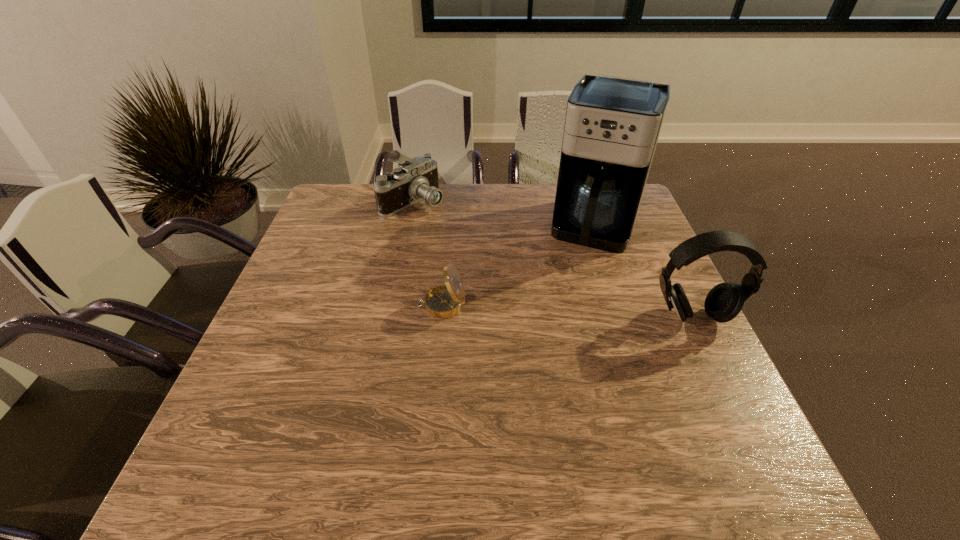
The height and width of the screenshot is (540, 960). In order to click on unoccupied position between the camera and the compass in this screenshot , I will do `click(427, 253)`.

You are a GUI agent. You are given a task and a screenshot of the screen. Output one action in this format:
    pyautogui.click(x=<x>, y=<y>)
    Task: Click on the free space that is in between the earphone and the tallest object
    The image size is (960, 540).
    Given the screenshot: What is the action you would take?
    pyautogui.click(x=644, y=272)

Find the location of a particular element. This screenshot has width=960, height=540. unoccupied position between the coffee maker and the third shortest object is located at coordinates (644, 272).

The image size is (960, 540). What are the coordinates of `unoccupied area between the compass and the earphone` in the screenshot? It's located at (567, 311).

Select which object is the closest to the camera. Please provide its 2D coordinates. Your answer should be formatted as a tuple, i.e. [(x, y)], where the tuple contains the x and y coordinates of a point satisfying the conditions above.

[(612, 125)]

At what (x,y) coordinates should I click in order to perform the action: click on object that stands as the closest to the camera. Please return your answer as a coordinate pair (x, y). This screenshot has width=960, height=540. Looking at the image, I should click on [x=612, y=125].